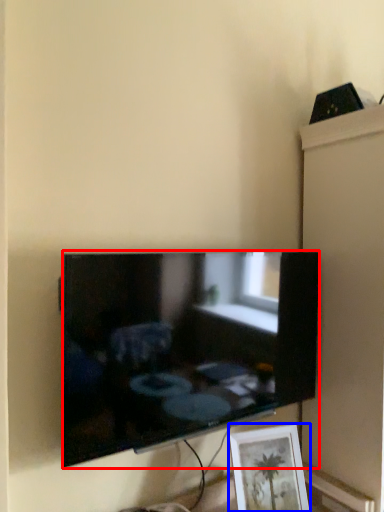
Question: Among these objects, which one is farthest to the camera, television (highlighted by a red box) or picture frame (highlighted by a blue box)?

Choices:
 (A) television
 (B) picture frame

Answer: (B)